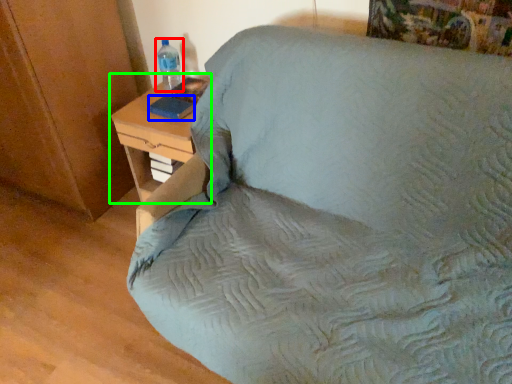
Question: Which object is the closest to the bottle (highlighted by a red box)? Choose among these: pad (highlighted by a blue box) or nightstand (highlighted by a green box).

Choices:
 (A) pad
 (B) nightstand

Answer: (A)